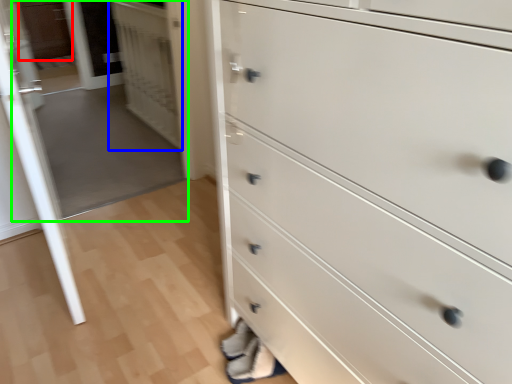
Question: Which object is positioned farthest from cabinetry (highlighted by a red box)? Select from door (highlighted by a blue box) and glass door (highlighted by a green box).

Choices:
 (A) door
 (B) glass door

Answer: (A)